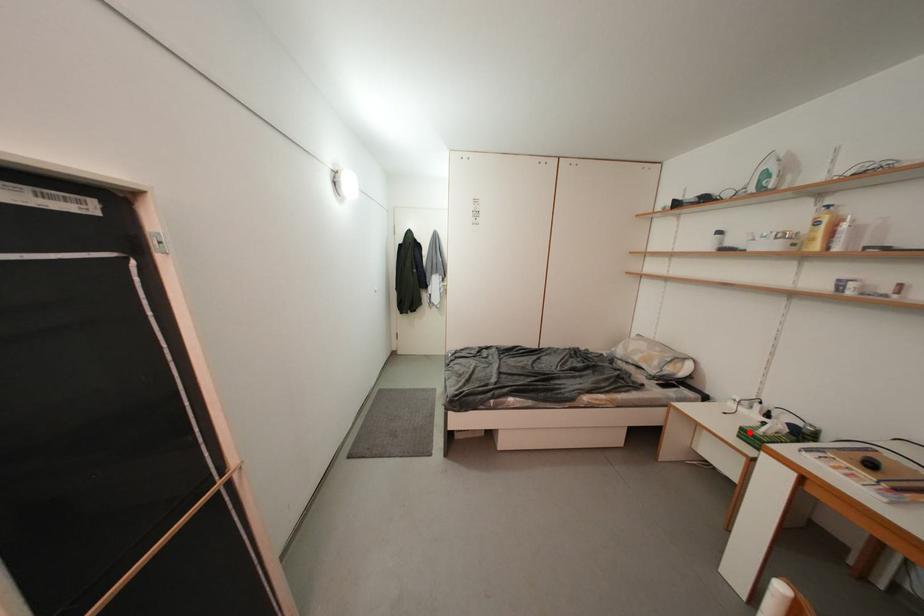
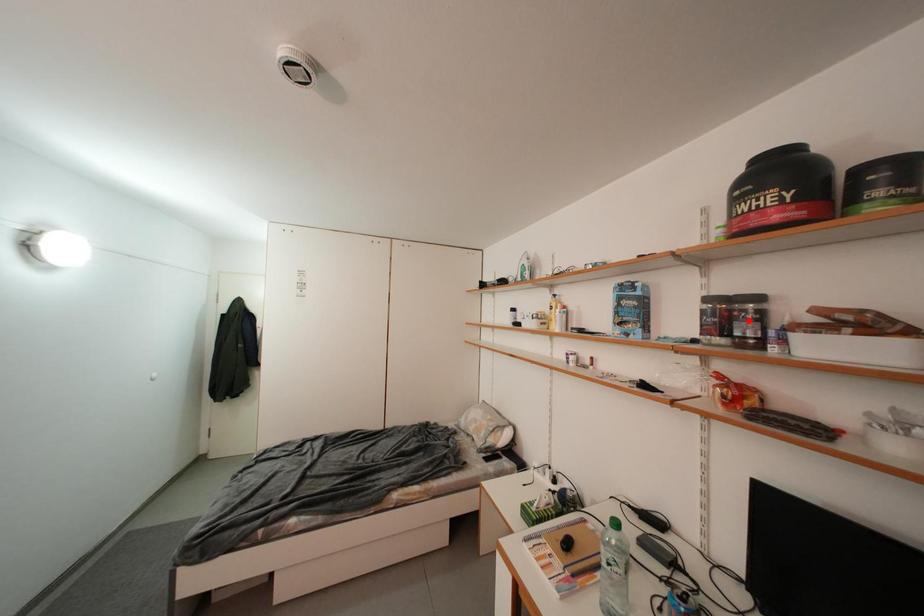
Looking at this image, I am providing you with two images of the same scene from different viewpoints. A red point is marked on the first image and another point is marked on the second image. Are the points marked in image1 and image2 representing the same 3D position?

No